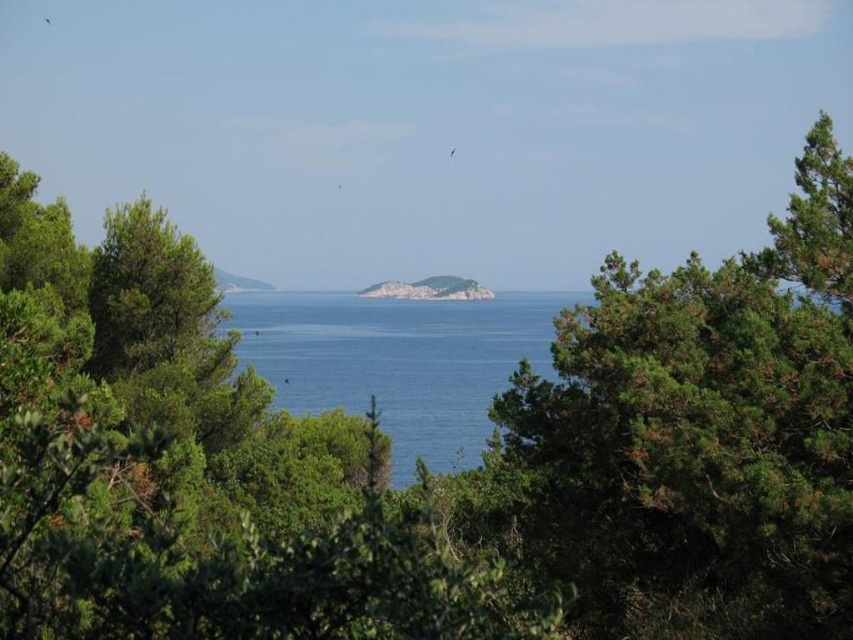
Question: Which point is farther from the camera taking this photo?

Choices:
 (A) (408, 296)
 (B) (297, 355)

Answer: (A)

Question: Can you confirm if blue water at center is wider than rugged stone island at center?

Choices:
 (A) yes
 (B) no

Answer: (A)

Question: Can you confirm if blue water at center is thinner than rugged stone island at center?

Choices:
 (A) yes
 (B) no

Answer: (B)

Question: Which point is closer to the camera?

Choices:
 (A) (547, 355)
 (B) (462, 280)

Answer: (A)

Question: From the image, what is the correct spatial relationship of blue water at center in relation to rugged stone island at center?

Choices:
 (A) above
 (B) below

Answer: (B)